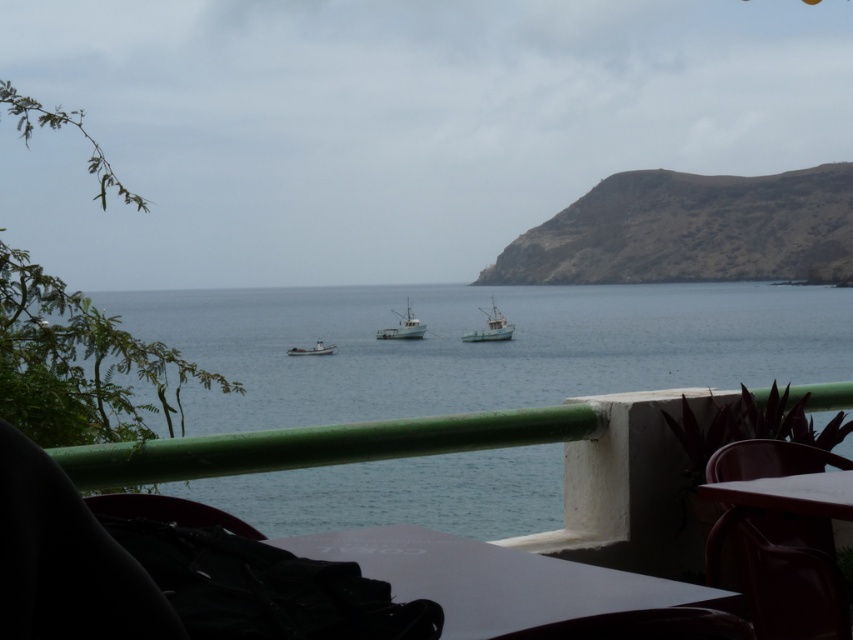
You are standing on the balcony and want to place a large tray on the white glossy table at lower center. Considering the size of the blue water at center and the table, will the tray fit on the table?

The blue water at center is larger than the white glossy table at lower center, but the size of the water does not affect the table. The tray can fit on the white glossy table at lower center as long as it is within the table dimensions.

You are standing on the balcony and want to look at the boats in the sea. If you move your gaze from the point at coordinates point (724, 385) to the point at coordinates point (618, 600), which direction do you need to move your eyes?

Since point (724, 385) is behind point (618, 600), you would need to move your gaze towards the foreground to look from point (724, 385) to point (618, 600).

You are standing on the balcony looking out. You see the matte plastic chair at lower right and the white wooden boat at center. Which object is positioned more to the right side of your view?

The matte plastic chair at lower right is positioned more to the right side of your view than the white wooden boat at center.